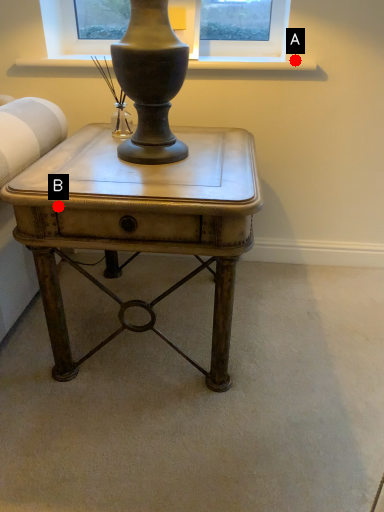
Question: Two points are circled on the image, labeled by A and B beside each circle. Which point appears closest to the camera in this image?

Choices:
 (A) A is closer
 (B) B is closer

Answer: (B)